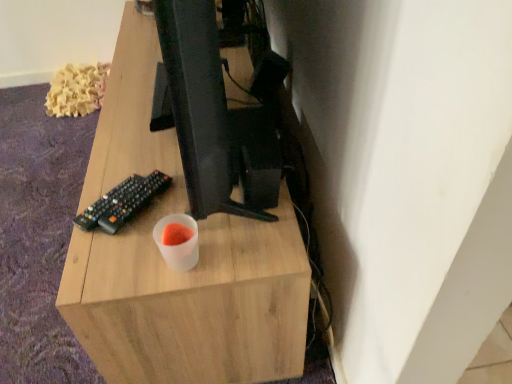
Where is `free space to the right of black plastic remote control at lower left`? The width and height of the screenshot is (512, 384). free space to the right of black plastic remote control at lower left is located at coordinates (207, 213).